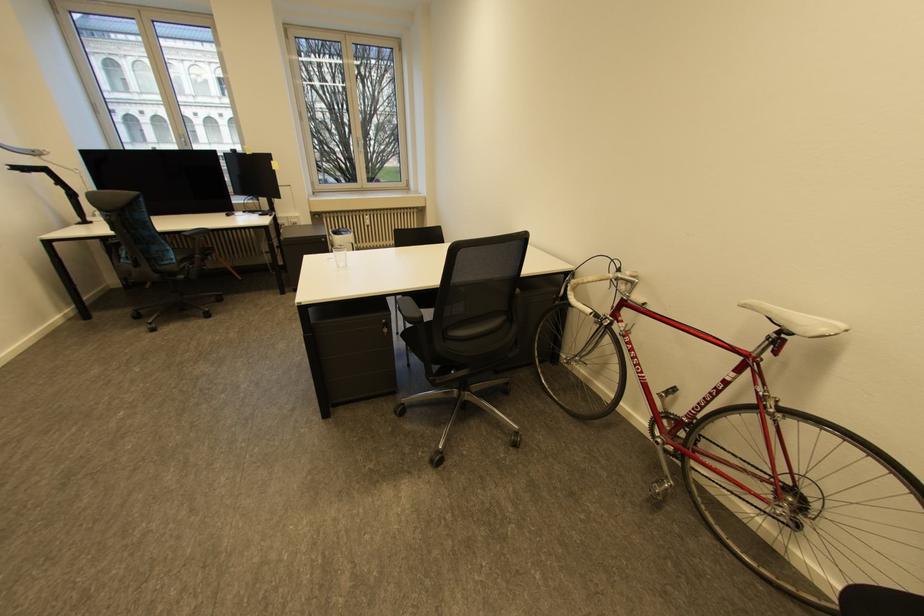
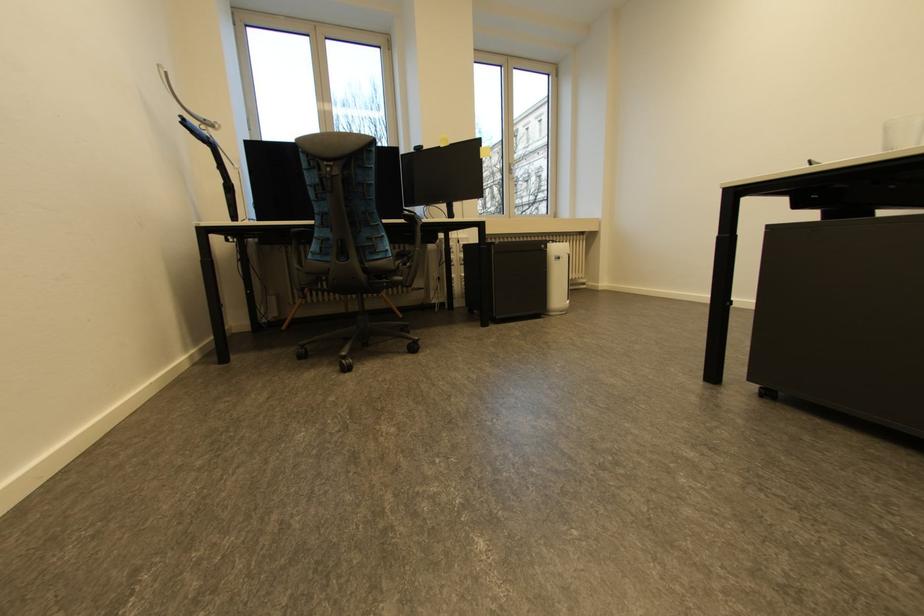
What movement of the cameraman would produce the second image?

The cameraman moved toward left, forward.